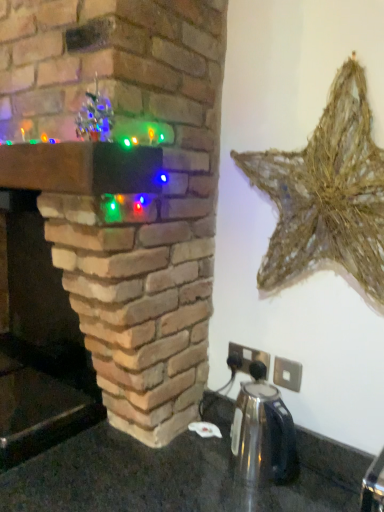
Question: Can you confirm if shiny metallic kettle at center is bigger than rustic straw star at upper right?

Choices:
 (A) yes
 (B) no

Answer: (B)

Question: Could you tell me if shiny metallic kettle at center is facing rustic straw star at upper right?

Choices:
 (A) yes
 (B) no

Answer: (B)

Question: Is shiny metallic kettle at center not close to rustic straw star at upper right?

Choices:
 (A) no
 (B) yes

Answer: (A)

Question: Is shiny metallic kettle at center taller than rustic straw star at upper right?

Choices:
 (A) no
 (B) yes

Answer: (A)

Question: Is the surface of shiny metallic kettle at center in direct contact with rustic straw star at upper right?

Choices:
 (A) yes
 (B) no

Answer: (B)

Question: Does shiny metallic kettle at center have a lesser height compared to rustic straw star at upper right?

Choices:
 (A) yes
 (B) no

Answer: (A)

Question: Is brick fireplace at center to the right of rustic straw star at upper right from the viewer's perspective?

Choices:
 (A) no
 (B) yes

Answer: (A)

Question: Does brick fireplace at center have a greater height compared to rustic straw star at upper right?

Choices:
 (A) no
 (B) yes

Answer: (B)

Question: Does brick fireplace at center have a smaller size compared to rustic straw star at upper right?

Choices:
 (A) no
 (B) yes

Answer: (A)

Question: From a real-world perspective, is brick fireplace at center physically above rustic straw star at upper right?

Choices:
 (A) no
 (B) yes

Answer: (A)

Question: Is brick fireplace at center facing away from rustic straw star at upper right?

Choices:
 (A) yes
 (B) no

Answer: (B)

Question: From the image's perspective, is brick fireplace at center on rustic straw star at upper right?

Choices:
 (A) no
 (B) yes

Answer: (B)

Question: Considering the relative sizes of rustic straw star at upper right and shiny metallic kettle at center in the image provided, is rustic straw star at upper right wider than shiny metallic kettle at center?

Choices:
 (A) yes
 (B) no

Answer: (B)